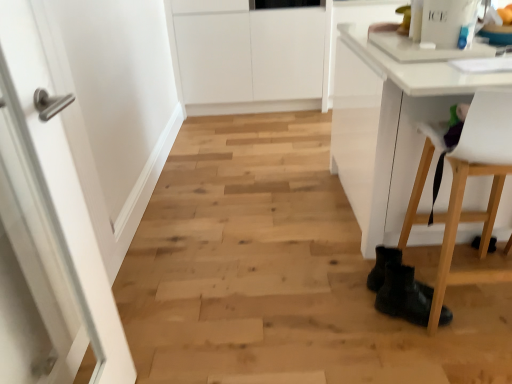
Question: Should I look upward or downward to see white plastic chair at lower right?

Choices:
 (A) up
 (B) down

Answer: (B)

Question: Does black leather boots at lower right have a greater height compared to white glossy door at left?

Choices:
 (A) no
 (B) yes

Answer: (A)

Question: Is black leather boots at lower right oriented away from white glossy door at left?

Choices:
 (A) yes
 (B) no

Answer: (B)

Question: Can you confirm if black leather boots at lower right is bigger than white glossy door at left?

Choices:
 (A) yes
 (B) no

Answer: (B)

Question: From a real-world perspective, is black leather boots at lower right on white glossy door at left?

Choices:
 (A) no
 (B) yes

Answer: (A)

Question: From the image's perspective, is black leather boots at lower right located beneath white glossy door at left?

Choices:
 (A) no
 (B) yes

Answer: (B)

Question: Is black leather boots at lower right not inside white glossy door at left?

Choices:
 (A) yes
 (B) no

Answer: (A)

Question: Does white glossy door at left appear on the left side of white plastic chair at lower right?

Choices:
 (A) yes
 (B) no

Answer: (A)

Question: Does white glossy door at left have a greater width compared to white plastic chair at lower right?

Choices:
 (A) yes
 (B) no

Answer: (B)

Question: From the image's perspective, is white glossy door at left located beneath white plastic chair at lower right?

Choices:
 (A) no
 (B) yes

Answer: (B)

Question: Can you confirm if white glossy door at left is shorter than white plastic chair at lower right?

Choices:
 (A) no
 (B) yes

Answer: (A)

Question: Considering the relative positions of white glossy door at left and white plastic chair at lower right in the image provided, is white glossy door at left behind white plastic chair at lower right?

Choices:
 (A) yes
 (B) no

Answer: (B)

Question: Is white plastic chair at lower right a part of white glossy door at left?

Choices:
 (A) no
 (B) yes

Answer: (A)

Question: From a real-world perspective, is white plastic chair at lower right below black leather boots at lower right?

Choices:
 (A) no
 (B) yes

Answer: (A)